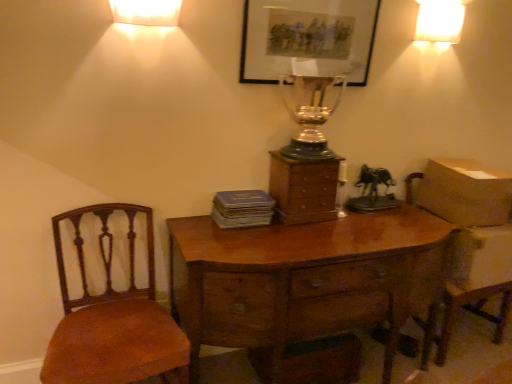
In order to face wooden chest of drawers at center, should I rotate leftwards or rightwards?

You should rotate right by 6.784 degrees.

What do you see at coordinates (465, 192) in the screenshot? The width and height of the screenshot is (512, 384). I see `brown cardboard box at right` at bounding box center [465, 192].

In order to face white frosted glass lampshade at upper center, the first lamp viewed from the left, should I rotate leftwards or rightwards?

Rotate left and turn 13.912 degrees.

The height and width of the screenshot is (384, 512). What do you see at coordinates (309, 110) in the screenshot?
I see `silver/glass trophy at center` at bounding box center [309, 110].

Measure the distance between point (403, 267) and camera.

Point (403, 267) is 1.89 meters away from camera.

In order to face wooden desk at center, should I rotate leftwards or rightwards?

A 7.629 degree turn to the right will do.

You are a GUI agent. You are given a task and a screenshot of the screen. Output one action in this format:
    pyautogui.click(x=<x>, y=<y>)
    Task: Click on the wooden chest of drawers at center
    This screenshot has height=384, width=512.
    Given the screenshot: What is the action you would take?
    pyautogui.click(x=303, y=189)

Could you tell me if silver/glass trophy at center is turned towards brown cardboard box at right?

No, silver/glass trophy at center does not turn towards brown cardboard box at right.

From a real-world perspective, which is physically above, silver/glass trophy at center or brown cardboard box at right?

silver/glass trophy at center, from a real-world perspective.

Between silver/glass trophy at center and brown cardboard box at right, which one has smaller size?

With smaller size is silver/glass trophy at center.

Is silver/glass trophy at center beside brown cardboard box at right?

No, silver/glass trophy at center is not in contact with brown cardboard box at right.

From a real-world perspective, is wooden armchair at right physically located above or below wooden desk at center?

Clearly, from a real-world perspective, wooden armchair at right is above wooden desk at center.

Is wooden armchair at right next to wooden desk at center?

wooden armchair at right and wooden desk at center are clearly separated.

Is wooden armchair at right wider than wooden desk at center?

In fact, wooden armchair at right might be narrower than wooden desk at center.

From a real-world perspective, which object stands above the other?

white glossy lampshade at upper right, arranged as the 2th lamp when viewed from the front, from a real-world perspective.

How much distance is there between silver/glass trophy at center and white glossy lampshade at upper right, marked as the first lamp in a top-to-bottom arrangement?

A distance of 26.43 inches exists between silver/glass trophy at center and white glossy lampshade at upper right, marked as the first lamp in a top-to-bottom arrangement.

Is silver/glass trophy at center to the left of white glossy lampshade at upper right, arranged as the 1th lamp when viewed from the right, from the viewer's perspective?

Correct, you'll find silver/glass trophy at center to the left of white glossy lampshade at upper right, arranged as the 1th lamp when viewed from the right.

Considering the sizes of objects silver/glass trophy at center and white glossy lampshade at upper right, arranged as the 2th lamp when viewed from the front, in the image provided, who is smaller, silver/glass trophy at center or white glossy lampshade at upper right, arranged as the 2th lamp when viewed from the front,?

white glossy lampshade at upper right, arranged as the 2th lamp when viewed from the front, is smaller.

Considering the sizes of objects wooden armchair at right and silver/glass trophy at center in the image provided, who is smaller, wooden armchair at right or silver/glass trophy at center?

Smaller between the two is silver/glass trophy at center.

Measure the distance between wooden armchair at right and silver/glass trophy at center.

A distance of 3.88 feet exists between wooden armchair at right and silver/glass trophy at center.

Is wooden armchair at right inside the boundaries of silver/glass trophy at center, or outside?

wooden armchair at right is spatially situated outside silver/glass trophy at center.

From a real-world perspective, which is physically above, wooden armchair at right or silver/glass trophy at center?

silver/glass trophy at center.

From the image's perspective, which is below, brown cardboard box at right or white glossy lampshade at upper right, arranged as the 1th lamp when viewed from the right?

brown cardboard box at right, from the image's perspective.

This screenshot has width=512, height=384. Find the location of `cardboard box below the white glossy lampshade at upper right, acting as the 2th lamp starting from the bottom (from the image's perspective)`. cardboard box below the white glossy lampshade at upper right, acting as the 2th lamp starting from the bottom (from the image's perspective) is located at coordinates (465, 192).

Based on the photo, in the image, is brown cardboard box at right positioned in front of or behind white glossy lampshade at upper right, the 2th lamp viewed from the left?

Visually, brown cardboard box at right is located behind white glossy lampshade at upper right, the 2th lamp viewed from the left.

Would you consider wooden desk at center to be distant from matte gray book at center?

No, wooden desk at center is not far away from matte gray book at center.

Is wooden desk at center at the left side of matte gray book at center?

No, wooden desk at center is not to the left of matte gray book at center.

This screenshot has height=384, width=512. I want to click on desk lying in front of the matte gray book at center, so click(x=304, y=280).

From a real-world perspective, which is physically above, wooden desk at center or matte gray book at center?

matte gray book at center, from a real-world perspective.

From the image's perspective, which is below, matte black picture frame at upper center or white frosted glass lampshade at upper center, which ranks as the second lamp in back-to-front order?

white frosted glass lampshade at upper center, which ranks as the second lamp in back-to-front order, appears lower in the image.

Between matte black picture frame at upper center and white frosted glass lampshade at upper center, positioned as the 1th lamp in bottom-to-top order, which one has larger width?

Wider between the two is white frosted glass lampshade at upper center, positioned as the 1th lamp in bottom-to-top order.

Is matte black picture frame at upper center behind white frosted glass lampshade at upper center, the first lamp viewed from the left?

Yes, it is.

Between matte black picture frame at upper center and white frosted glass lampshade at upper center, which ranks as the second lamp in back-to-front order, which one appears on the left side from the viewer's perspective?

white frosted glass lampshade at upper center, which ranks as the second lamp in back-to-front order, is more to the left.

Identify the location of candle holder above the brown cardboard box at right (from the image's perspective). The height and width of the screenshot is (384, 512). (309, 110).

At what (x,y) coordinates should I click in order to perform the action: click on desk located below the wooden armchair at right (from the image's perspective). Please return your answer as a coordinate pair (x, y). The height and width of the screenshot is (384, 512). Looking at the image, I should click on (304, 280).

Considering their positions, is white frosted glass lampshade at upper center, the 1th lamp positioned from the front, positioned further to silver/glass trophy at center than matte gray book at center?

white frosted glass lampshade at upper center, the 1th lamp positioned from the front, is further to silver/glass trophy at center.

When comparing their distances from wooden armchair at right, does silver/glass trophy at center or matte gray book at center seem further?

matte gray book at center.

Considering their positions, is wooden desk at center positioned closer to silver/glass trophy at center than matte gray book at center?

Among the two, matte gray book at center is located nearer to silver/glass trophy at center.

Considering their positions, is matte gray book at center positioned further to silver/glass trophy at center than wooden desk at center?

Among the two, wooden desk at center is located further to silver/glass trophy at center.

Consider the image. Considering their positions, is brown fabric chair at left positioned further to wooden desk at center than white glossy lampshade at upper right, acting as the 2th lamp starting from the bottom?

Based on the image, white glossy lampshade at upper right, acting as the 2th lamp starting from the bottom, appears to be further to wooden desk at center.

When comparing their distances from brown cardboard box at right, does wooden chest of drawers at center or wooden desk at center seem further?

wooden chest of drawers at center lies further to brown cardboard box at right than the other object.

When comparing their distances from matte gray book at center, does wooden chest of drawers at center or brown cardboard box at right seem further?

brown cardboard box at right is positioned further to the anchor matte gray book at center.

From the image, which object appears to be nearer to matte black picture frame at upper center, white frosted glass lampshade at upper center, the second lamp viewed from the right, or silver/glass trophy at center?

silver/glass trophy at center is positioned closer to the anchor matte black picture frame at upper center.

Locate an element on the screen. chest of drawers between brown fabric chair at left and brown cardboard box at right from left to right is located at coordinates (303, 189).

Identify the location of cardboard box that lies between white glossy lampshade at upper right, marked as the first lamp in a top-to-bottom arrangement, and wooden desk at center from top to bottom. (465, 192).

The image size is (512, 384). Find the location of `picture frame situated between brown fabric chair at left and wooden armchair at right from left to right`. picture frame situated between brown fabric chair at left and wooden armchair at right from left to right is located at coordinates (307, 37).

Identify the location of armchair between silver/glass trophy at center and brown cardboard box at right in the horizontal direction. This screenshot has height=384, width=512. (472, 312).